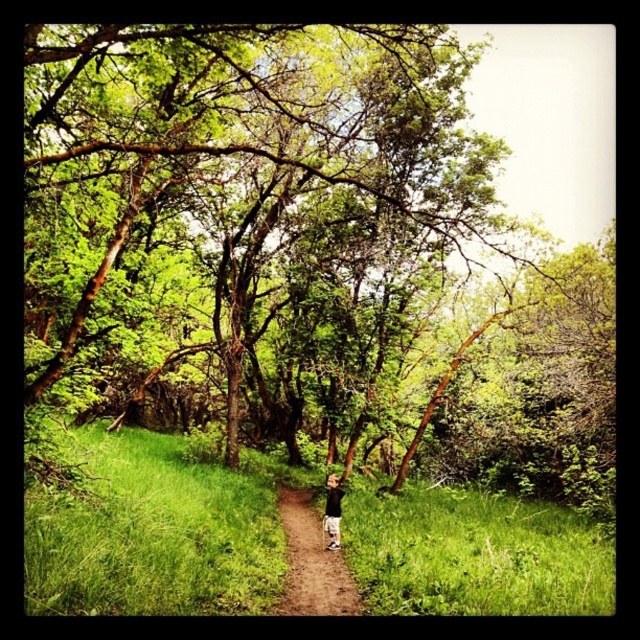
You are standing at the entrance of the forest path and see the green leafy tree at center. If you walk straight ahead, will you eventually come to the tree?

Yes, because the green leafy tree at center is located along the path you are facing, so walking straight will lead you to it.

You are a hiker trying to follow the brown dirt path at center through the forest. There is a green leafy tree at center blocking your way. Can you walk around the tree without leaving the path?

The green leafy tree at center is larger in size than brown dirt path at center, so it may block the path. However, since the path is narrow, you might have to navigate carefully around the tree while staying on the path.

You are a hiker carrying a backpack and see the green leafy tree at center and the black cotton shirt at center in the forest. You want to place your backpack between them. Is there enough space to fit your backpack that is 2 feet wide?

The green leafy tree at center and the black cotton shirt at center are 27.07 feet apart from each other, so yes, there is enough space to fit your backpack between them since the distance is much larger than the backpack width of 2 feet.